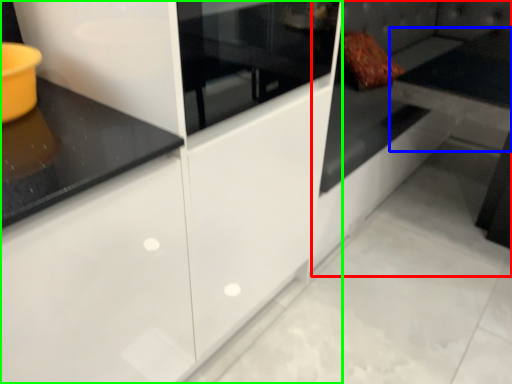
Question: Which object is positioned closest to couch (highlighted by a red box)? Select from table (highlighted by a blue box) and cabinetry (highlighted by a green box).

Choices:
 (A) table
 (B) cabinetry

Answer: (B)